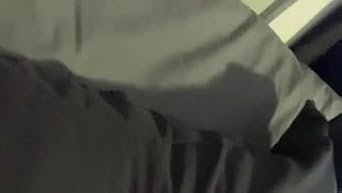
Identify the location of gray fabric. The height and width of the screenshot is (193, 342). (94, 141).